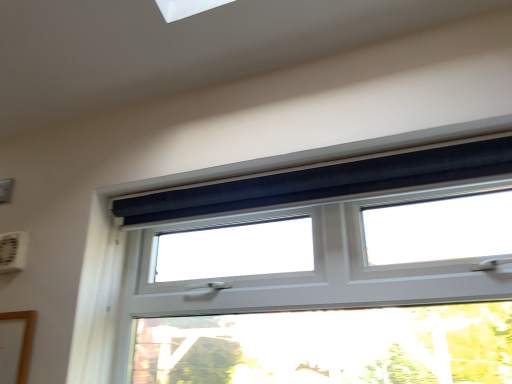
Question: From the image's perspective, is black velvet curtain at upper center on top of white plastic air conditioning unit at upper left?

Choices:
 (A) no
 (B) yes

Answer: (A)

Question: Is black velvet curtain at upper center positioned behind white plastic air conditioning unit at upper left?

Choices:
 (A) no
 (B) yes

Answer: (A)

Question: From the image's perspective, is black velvet curtain at upper center located beneath white plastic air conditioning unit at upper left?

Choices:
 (A) no
 (B) yes

Answer: (B)

Question: Is black velvet curtain at upper center at the right side of white plastic air conditioning unit at upper left?

Choices:
 (A) yes
 (B) no

Answer: (A)

Question: Is white plastic air conditioning unit at upper left inside black velvet curtain at upper center?

Choices:
 (A) yes
 (B) no

Answer: (B)

Question: Is black velvet curtain at upper center bigger than white plastic air conditioning unit at upper left?

Choices:
 (A) no
 (B) yes

Answer: (B)

Question: Can you confirm if white plastic air conditioning unit at upper left is shorter than black velvet curtain at upper center?

Choices:
 (A) yes
 (B) no

Answer: (A)

Question: Does white plastic air conditioning unit at upper left lie in front of black velvet curtain at upper center?

Choices:
 (A) yes
 (B) no

Answer: (B)

Question: Is white plastic air conditioning unit at upper left positioned far away from black velvet curtain at upper center?

Choices:
 (A) no
 (B) yes

Answer: (A)

Question: Is white plastic air conditioning unit at upper left located outside black velvet curtain at upper center?

Choices:
 (A) no
 (B) yes

Answer: (B)

Question: Can you confirm if white plastic air conditioning unit at upper left is thinner than black velvet curtain at upper center?

Choices:
 (A) no
 (B) yes

Answer: (B)

Question: Can you confirm if white plastic air conditioning unit at upper left is bigger than black velvet curtain at upper center?

Choices:
 (A) no
 (B) yes

Answer: (A)

Question: From a real-world perspective, is black velvet curtain at upper center positioned above or below white plastic air conditioning unit at upper left?

Choices:
 (A) below
 (B) above

Answer: (A)